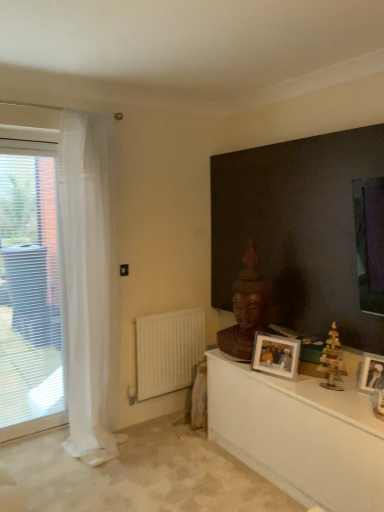
Find the location of a particular element. This screenshot has width=384, height=512. free space in front of wooden toy at right is located at coordinates (332, 402).